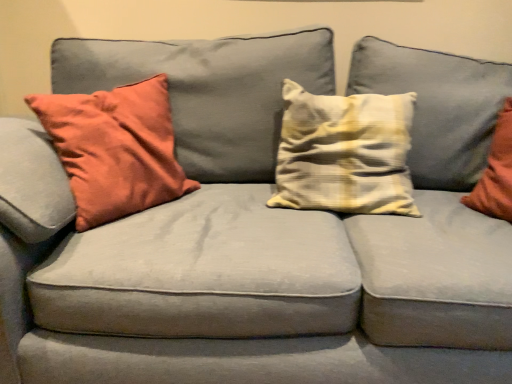
Question: Considering the relative sizes of yellow striped pillow at center, which is the 2th pillow from left to right, and matte orange pillow at left, the second pillow when ordered from right to left, in the image provided, is yellow striped pillow at center, which is the 2th pillow from left to right, bigger than matte orange pillow at left, the second pillow when ordered from right to left,?

Choices:
 (A) no
 (B) yes

Answer: (A)

Question: Does yellow striped pillow at center, which is the 2th pillow from left to right, have a greater height compared to matte orange pillow at left, the second pillow when ordered from right to left?

Choices:
 (A) no
 (B) yes

Answer: (A)

Question: From a real-world perspective, is yellow striped pillow at center, which is the 2th pillow from left to right, on top of matte orange pillow at left, the second pillow when ordered from right to left?

Choices:
 (A) yes
 (B) no

Answer: (A)

Question: Is yellow striped pillow at center, which is the 2th pillow from left to right, at the left side of matte orange pillow at left, which is counted as the 1th pillow, starting from the left?

Choices:
 (A) no
 (B) yes

Answer: (A)

Question: Is yellow striped pillow at center, which is the 1th pillow in right-to-left order, directly adjacent to matte orange pillow at left, which is counted as the 1th pillow, starting from the left?

Choices:
 (A) no
 (B) yes

Answer: (A)

Question: Is yellow striped pillow at center, which is the 2th pillow from left to right, shorter than matte orange pillow at left, which is counted as the 1th pillow, starting from the left?

Choices:
 (A) no
 (B) yes

Answer: (B)

Question: Is matte orange pillow at left, which is counted as the 1th pillow, starting from the left, far away from yellow striped pillow at center, which is the 2th pillow from left to right?

Choices:
 (A) yes
 (B) no

Answer: (B)

Question: Is matte orange pillow at left, which is counted as the 1th pillow, starting from the left, looking in the opposite direction of yellow striped pillow at center, which is the 2th pillow from left to right?

Choices:
 (A) yes
 (B) no

Answer: (B)

Question: From the image's perspective, is matte orange pillow at left, which is counted as the 1th pillow, starting from the left, below yellow striped pillow at center, which is the 1th pillow in right-to-left order?

Choices:
 (A) yes
 (B) no

Answer: (A)

Question: Is matte orange pillow at left, the second pillow when ordered from right to left, closer to camera compared to yellow striped pillow at center, which is the 2th pillow from left to right?

Choices:
 (A) yes
 (B) no

Answer: (A)

Question: From a real-world perspective, is matte orange pillow at left, the second pillow when ordered from right to left, located higher than yellow striped pillow at center, which is the 2th pillow from left to right?

Choices:
 (A) no
 (B) yes

Answer: (A)

Question: Is matte orange pillow at left, the second pillow when ordered from right to left, beside yellow striped pillow at center, which is the 2th pillow from left to right?

Choices:
 (A) no
 (B) yes

Answer: (A)

Question: Does point (105, 190) appear closer or farther from the camera than point (285, 97)?

Choices:
 (A) closer
 (B) farther

Answer: (A)